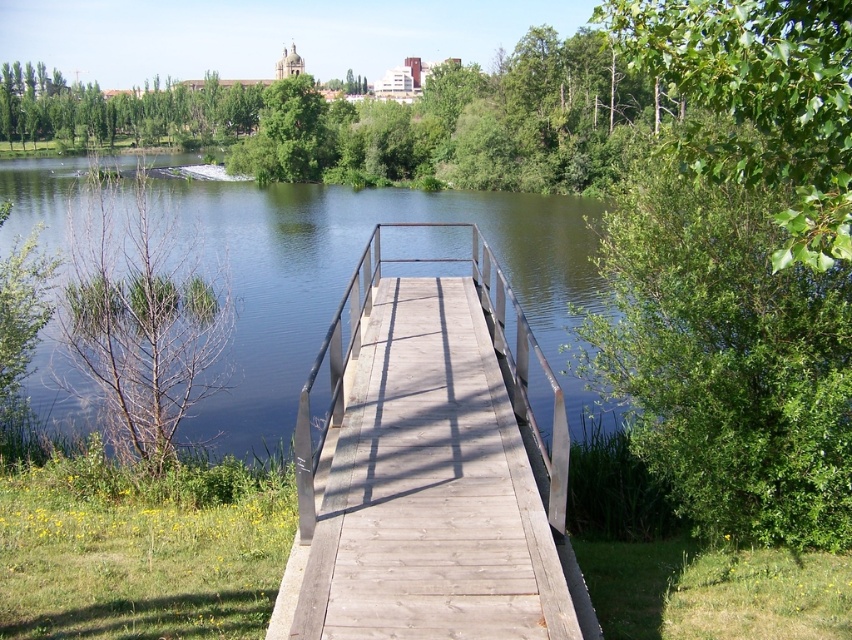
Looking at this image, can you confirm if wooden dock at center is positioned above dark brown water at center?

No.

Who is more forward, (394, 358) or (323, 218)?

Point (394, 358) is more forward.

Does point (327, 330) come farther from viewer compared to point (409, 230)?

No, it is not.

The height and width of the screenshot is (640, 852). Identify the location of wooden dock at center. (x=430, y=468).